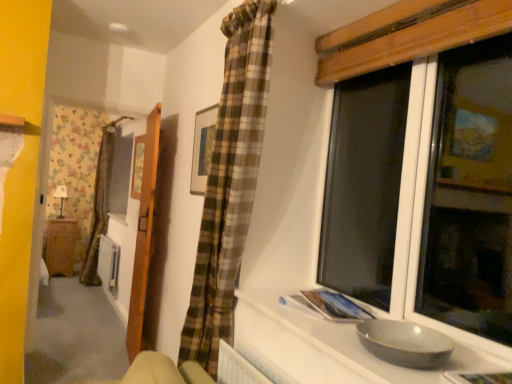
Question: Is wooden cabinet at left positioned behind matte black lamp at left?

Choices:
 (A) yes
 (B) no

Answer: (B)

Question: Does wooden cabinet at left touch matte black lamp at left?

Choices:
 (A) no
 (B) yes

Answer: (A)

Question: Can you confirm if wooden cabinet at left is thinner than matte black lamp at left?

Choices:
 (A) yes
 (B) no

Answer: (B)

Question: Is the depth of wooden cabinet at left less than that of matte black lamp at left?

Choices:
 (A) no
 (B) yes

Answer: (B)

Question: From the image's perspective, is wooden cabinet at left beneath matte black lamp at left?

Choices:
 (A) yes
 (B) no

Answer: (A)

Question: Considering the positions of wooden picture frame at upper center, the second picture frame when ordered from right to left, and wooden door at left in the image, is wooden picture frame at upper center, the second picture frame when ordered from right to left, bigger or smaller than wooden door at left?

Choices:
 (A) small
 (B) big

Answer: (A)

Question: From the image's perspective, relative to wooden door at left, is wooden picture frame at upper center, which is the first picture frame from back to front, above or below?

Choices:
 (A) below
 (B) above

Answer: (B)

Question: From their relative heights in the image, would you say wooden picture frame at upper center, the second picture frame when ordered from right to left, is taller or shorter than wooden door at left?

Choices:
 (A) tall
 (B) short

Answer: (B)

Question: In the image, is wooden picture frame at upper center, marked as the second picture frame in a front-to-back arrangement, on the left side or the right side of wooden door at left?

Choices:
 (A) left
 (B) right

Answer: (A)

Question: Would you say wooden framed picture at upper center, the first picture frame viewed from the right, is to the left or to the right of wooden picture frame at upper center, which is the first picture frame from back to front, in the picture?

Choices:
 (A) left
 (B) right

Answer: (B)

Question: Would you say wooden framed picture at upper center, which appears as the 1th picture frame when viewed from the front, is inside or outside wooden picture frame at upper center, marked as the second picture frame in a front-to-back arrangement?

Choices:
 (A) outside
 (B) inside

Answer: (A)

Question: Is point (212, 132) closer or farther from the camera than point (141, 142)?

Choices:
 (A) closer
 (B) farther

Answer: (A)

Question: From their relative heights in the image, would you say wooden framed picture at upper center, which appears as the 1th picture frame when viewed from the front, is taller or shorter than wooden picture frame at upper center, the second picture frame when ordered from right to left?

Choices:
 (A) short
 (B) tall

Answer: (A)

Question: Considering the positions of wooden picture frame at upper center, the second picture frame when ordered from right to left, and gray matte bowl at lower right in the image, is wooden picture frame at upper center, the second picture frame when ordered from right to left, wider or thinner than gray matte bowl at lower right?

Choices:
 (A) wide
 (B) thin

Answer: (B)

Question: Considering the positions of wooden picture frame at upper center, the second picture frame when ordered from right to left, and gray matte bowl at lower right in the image, is wooden picture frame at upper center, the second picture frame when ordered from right to left, taller or shorter than gray matte bowl at lower right?

Choices:
 (A) short
 (B) tall

Answer: (B)